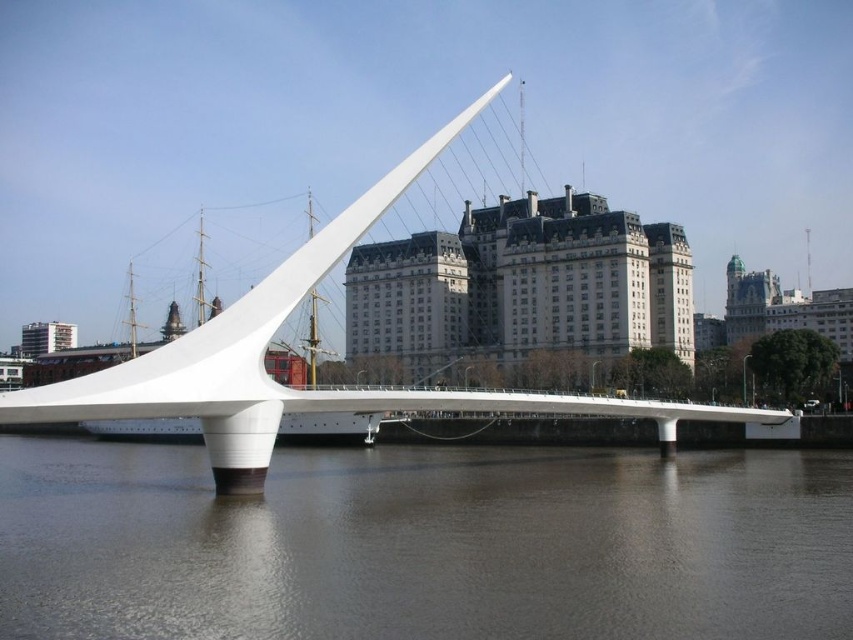
Question: Which point is farther to the camera?

Choices:
 (A) white smooth bridge at center
 (B) brown reflective water at center

Answer: (A)

Question: Which point is closer to the camera?

Choices:
 (A) (699, 618)
 (B) (582, 404)

Answer: (A)

Question: Is brown reflective water at center wider than white smooth bridge at center?

Choices:
 (A) no
 (B) yes

Answer: (B)

Question: Can you confirm if brown reflective water at center is thinner than white smooth bridge at center?

Choices:
 (A) no
 (B) yes

Answer: (A)

Question: Can you confirm if brown reflective water at center is bigger than white smooth bridge at center?

Choices:
 (A) yes
 (B) no

Answer: (B)